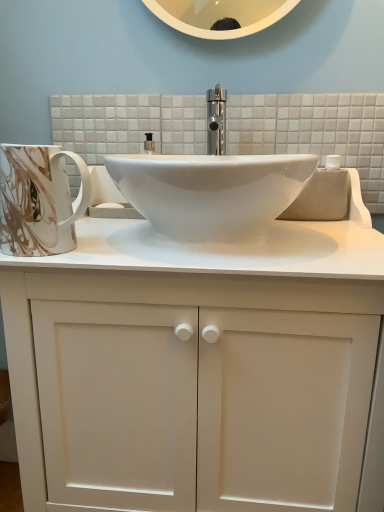
Find the location of a particular element. marble-patterned ceramic mug at left is located at coordinates (38, 200).

What do you see at coordinates (38, 200) in the screenshot? Image resolution: width=384 pixels, height=512 pixels. I see `marble-patterned ceramic mug at left` at bounding box center [38, 200].

At what (x,y) coordinates should I click in order to perform the action: click on white matte cabinet at center. Please return your answer as a coordinate pair (x, y). This screenshot has height=512, width=384. Looking at the image, I should click on click(194, 368).

The height and width of the screenshot is (512, 384). What do you see at coordinates (194, 368) in the screenshot?
I see `white matte cabinet at center` at bounding box center [194, 368].

You are a GUI agent. You are given a task and a screenshot of the screen. Output one action in this format:
    pyautogui.click(x=<x>, y=<y>)
    Task: Click on the marble-patterned ceramic mug at left
    The height and width of the screenshot is (512, 384).
    Given the screenshot: What is the action you would take?
    pyautogui.click(x=38, y=200)

In the image, is marble-patterned ceramic mug at left on the left side or the right side of white matte cabinet at center?

Clearly, marble-patterned ceramic mug at left is on the left of white matte cabinet at center in the image.

Is the depth of marble-patterned ceramic mug at left greater than that of white matte cabinet at center?

Yes, it is.

Is point (12, 220) closer or farther from the camera than point (49, 447)?

Point (12, 220) appears to be closer to the viewer than point (49, 447).

From the image's perspective, is marble-patterned ceramic mug at left above or below white matte cabinet at center?

From the image's perspective, marble-patterned ceramic mug at left appears above white matte cabinet at center.

From a real-world perspective, is marble-patterned ceramic mug at left positioned over white matte cabinet at center based on gravity?

Yes.

In the scene shown: In terms of width, does marble-patterned ceramic mug at left look wider or thinner when compared to white matte cabinet at center?

In the image, marble-patterned ceramic mug at left appears to be more narrow than white matte cabinet at center.

Considering the sizes of objects marble-patterned ceramic mug at left and white matte cabinet at center in the image provided, who is shorter, marble-patterned ceramic mug at left or white matte cabinet at center?

With less height is marble-patterned ceramic mug at left.

Between marble-patterned ceramic mug at left and white matte cabinet at center, which one has larger size?

white matte cabinet at center is bigger.

Would you say marble-patterned ceramic mug at left is inside or outside white matte cabinet at center?

marble-patterned ceramic mug at left is located inside white matte cabinet at center.

Is marble-patterned ceramic mug at left next to white matte cabinet at center and touching it?

They are not placed beside each other.

Does marble-patterned ceramic mug at left turn towards white matte cabinet at center?

Yes, marble-patterned ceramic mug at left faces towards white matte cabinet at center.

Can you tell me how much marble-patterned ceramic mug at left and white matte cabinet at center differ in facing direction?

0.478 degrees separate the facing orientations of marble-patterned ceramic mug at left and white matte cabinet at center.

How distant is marble-patterned ceramic mug at left from white matte cabinet at center?

They are 11.23 inches apart.

The height and width of the screenshot is (512, 384). Find the location of `bathroom cabinet lying on the right of marble-patterned ceramic mug at left`. bathroom cabinet lying on the right of marble-patterned ceramic mug at left is located at coordinates (194, 368).

Between white matte cabinet at center and marble-patterned ceramic mug at left, which one appears on the left side from the viewer's perspective?

marble-patterned ceramic mug at left.

Is white matte cabinet at center in front of marble-patterned ceramic mug at left?

Yes, white matte cabinet at center is closer to the camera.

Is point (344, 430) closer or farther from the camera than point (3, 164)?

Clearly, point (344, 430) is more distant from the camera than point (3, 164).

From the image's perspective, is white matte cabinet at center beneath marble-patterned ceramic mug at left?

Correct, white matte cabinet at center appears lower than marble-patterned ceramic mug at left in the image.

From a real-world perspective, is white matte cabinet at center beneath marble-patterned ceramic mug at left?

Indeed, from a real-world perspective, white matte cabinet at center is positioned beneath marble-patterned ceramic mug at left.

Which object is thinner, white matte cabinet at center or marble-patterned ceramic mug at left?

marble-patterned ceramic mug at left is thinner.

Does white matte cabinet at center have a greater height compared to marble-patterned ceramic mug at left?

Indeed, white matte cabinet at center has a greater height compared to marble-patterned ceramic mug at left.

Between white matte cabinet at center and marble-patterned ceramic mug at left, which one has larger size?

With larger size is white matte cabinet at center.

Is white matte cabinet at center positioned beyond the bounds of marble-patterned ceramic mug at left?

That's correct, white matte cabinet at center is outside of marble-patterned ceramic mug at left.

Would you say white matte cabinet at center is a long distance from marble-patterned ceramic mug at left?

That's not correct — white matte cabinet at center is a little close to marble-patterned ceramic mug at left.

Is white matte cabinet at center aimed at marble-patterned ceramic mug at left?

No, white matte cabinet at center does not turn towards marble-patterned ceramic mug at left.

This screenshot has height=512, width=384. What are the coordinates of `bathroom cabinet on the right of marble-patterned ceramic mug at left` in the screenshot? It's located at (194, 368).

The height and width of the screenshot is (512, 384). I want to click on mug behind the white matte cabinet at center, so click(x=38, y=200).

Locate an element on the screen. The width and height of the screenshot is (384, 512). bathroom cabinet below the marble-patterned ceramic mug at left (from a real-world perspective) is located at coordinates (194, 368).